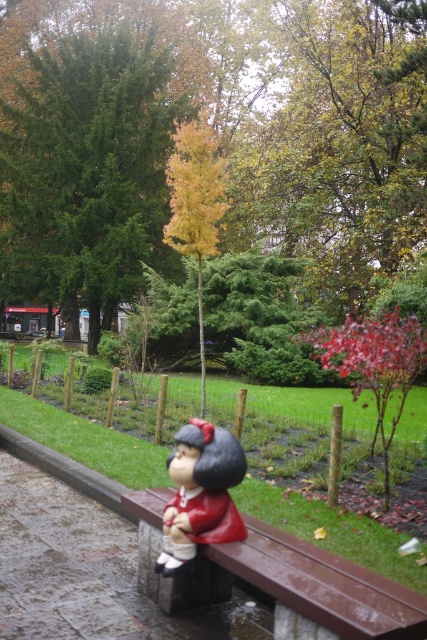
Between yellow-green leaves at center and brown metallic bench at lower center, which one has more height?

yellow-green leaves at center

Does point (310, 241) come farther from viewer compared to point (377, 584)?

Yes.

Identify the location of yellow-green leaves at center. Image resolution: width=427 pixels, height=640 pixels. (213, 136).

Who is higher up, yellow-green leaves at center or yellow-green foliage at center?

yellow-green leaves at center is higher up.

Between yellow-green leaves at center and yellow-green foliage at center, which one appears on the left side from the viewer's perspective?

Positioned to the left is yellow-green leaves at center.

Where is `yellow-green leaves at center`? The width and height of the screenshot is (427, 640). yellow-green leaves at center is located at coordinates (213, 136).

Identify the location of yellow-green leaves at center. The height and width of the screenshot is (640, 427). (213, 136).

Can you confirm if matte red doll at center is taller than yellow-green foliage at center?

No, matte red doll at center is not taller than yellow-green foliage at center.

You are a GUI agent. You are given a task and a screenshot of the screen. Output one action in this format:
    pyautogui.click(x=<x>, y=<y>)
    Task: Click on the matte red doll at center
    
    Given the screenshot: What is the action you would take?
    pyautogui.click(x=201, y=493)